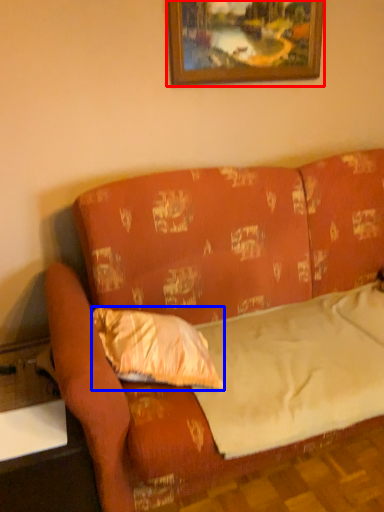
Question: Which point is further to the camera, picture frame (highlighted by a red box) or pillow (highlighted by a blue box)?

Choices:
 (A) picture frame
 (B) pillow

Answer: (A)